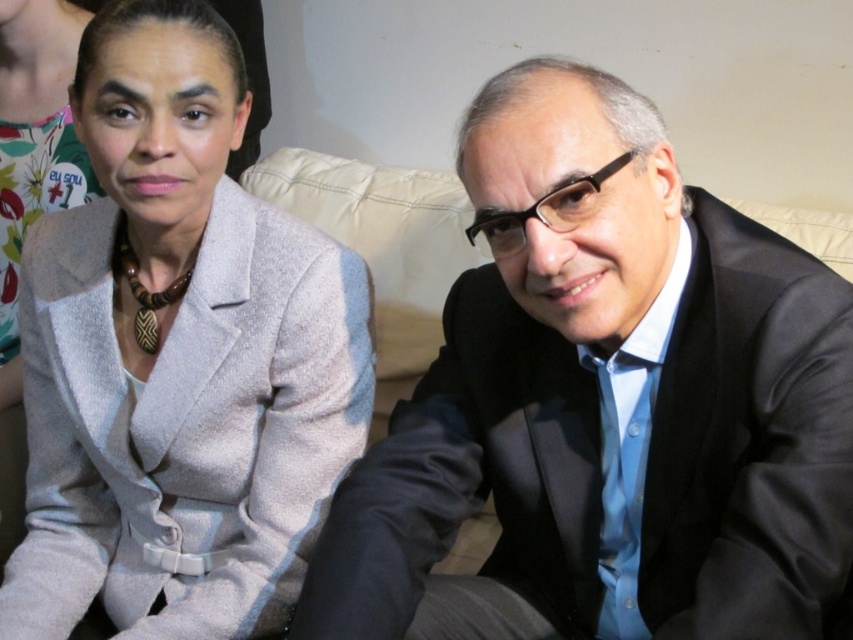
Question: Can you confirm if matte gray blazer at center is positioned to the left of matte gray blazer at upper left?

Choices:
 (A) no
 (B) yes

Answer: (A)

Question: Estimate the real-world distances between objects in this image. Which object is closer to the matte gray blazer at center?

Choices:
 (A) black glossy suit at right
 (B) matte gray blazer at upper left

Answer: (A)

Question: Does black glossy suit at right have a smaller size compared to matte gray blazer at upper left?

Choices:
 (A) yes
 (B) no

Answer: (B)

Question: Which object is the farthest from the matte gray blazer at upper left?

Choices:
 (A) black glossy suit at right
 (B) matte gray blazer at center

Answer: (A)

Question: Considering the relative positions of matte gray blazer at center and matte gray blazer at upper left in the image provided, where is matte gray blazer at center located with respect to matte gray blazer at upper left?

Choices:
 (A) right
 (B) left

Answer: (A)

Question: Which object is closer to the camera taking this photo?

Choices:
 (A) black glossy suit at right
 (B) matte gray blazer at upper left

Answer: (A)